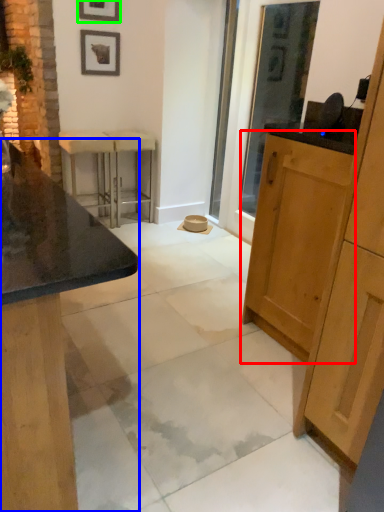
Question: Which object is the closest to the cabinetry (highlighted by a red box)? Choose among these: cabinetry (highlighted by a blue box) or picture frame (highlighted by a green box).

Choices:
 (A) cabinetry
 (B) picture frame

Answer: (A)